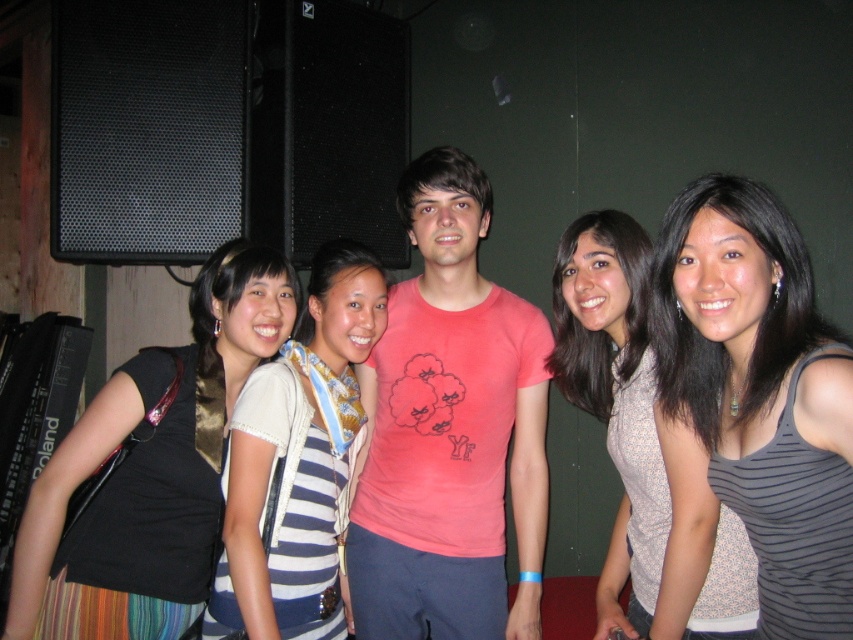
You are at a social event and want to take a photo of the patterned fabric top at center without the black fabric at left blocking it. What should you do?

Move to the right side of the black fabric at left so that the patterned fabric top at center is no longer blocked by it.

You are standing in the center of the image and want to move towards the black fabric at left. In which direction should you move?

You should move to the left to reach the black fabric at left since it is located at point (151, 468), which is on the left side of the image.